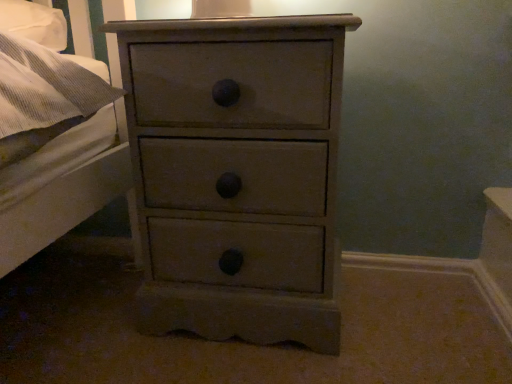
I want to click on vacant space positioned to the left of matte gray chest of drawers at center, so click(74, 332).